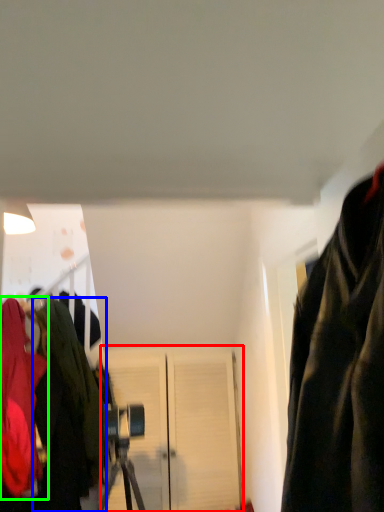
Question: Estimate the real-world distances between objects in this image. Which object is farther from door (highlighted by a red box), jacket (highlighted by a blue box) or jacket (highlighted by a green box)?

Choices:
 (A) jacket
 (B) jacket

Answer: (B)